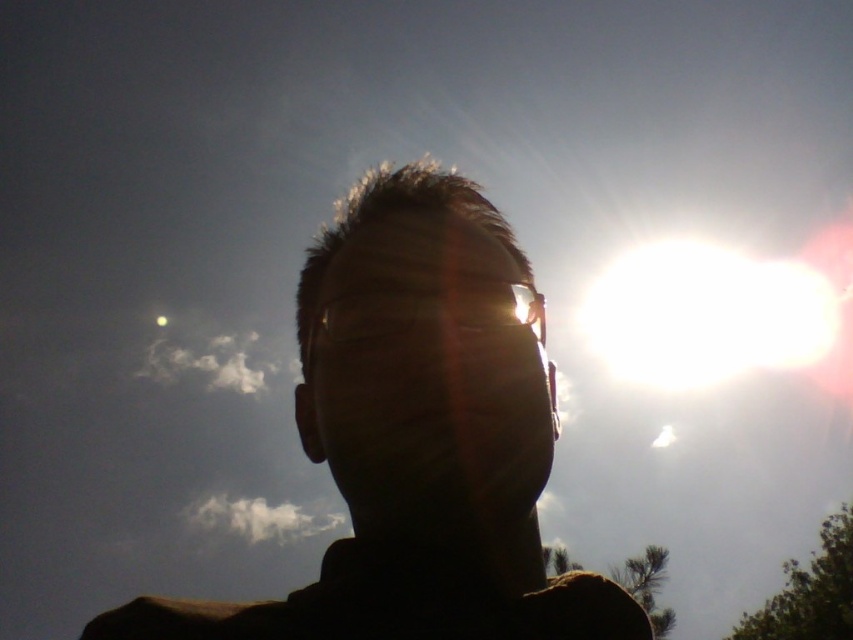
Who is positioned more to the left, silhouette face at center or silky skin face at center?

silhouette face at center

Between point (317, 257) and point (450, 320), which one is positioned behind?

Positioned behind is point (317, 257).

Where is `silhouette face at center`? This screenshot has width=853, height=640. silhouette face at center is located at coordinates (418, 436).

Between silky skin face at center and white glossy sun at upper right, which one is positioned lower?

silky skin face at center is below.

This screenshot has width=853, height=640. I want to click on silky skin face at center, so click(x=428, y=365).

Which is behind, point (305, 387) or point (659, 328)?

Point (659, 328)

Where is `silky skin face at center`? Image resolution: width=853 pixels, height=640 pixels. silky skin face at center is located at coordinates (428, 365).

From the picture: Does silhouette face at center appear under white glossy sun at upper right?

Yes, silhouette face at center is below white glossy sun at upper right.

Which is below, silhouette face at center or white glossy sun at upper right?

silhouette face at center is lower down.

Who is more forward, [436,618] or [833,253]?

Point [436,618] is more forward.

Identify the location of silhouette face at center. The width and height of the screenshot is (853, 640). (418, 436).